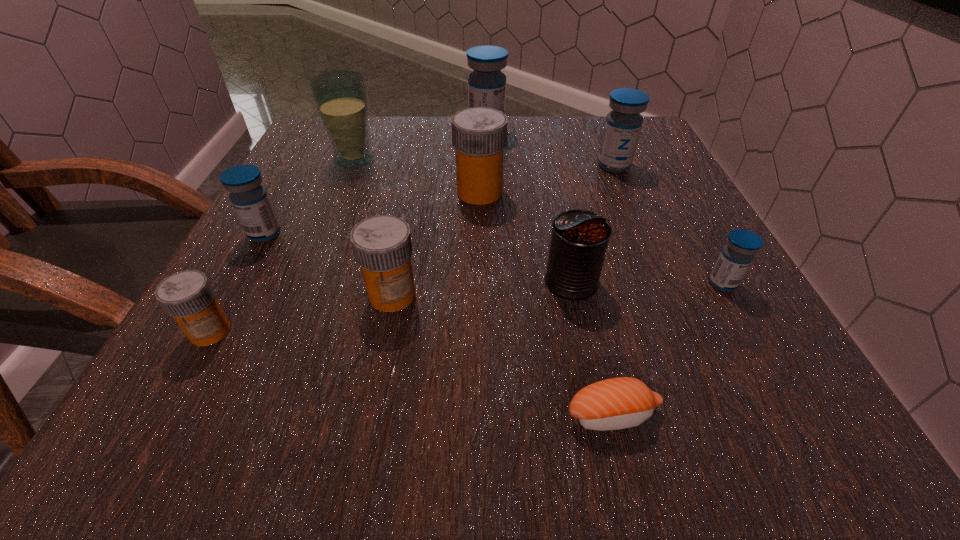
Point out which medicine is positioned as the sixth nearest to the ninth farthest object. Please provide its 2D coordinates. Your answer should be formatted as a tuple, i.e. [(x, y)], where the tuple contains the x and y coordinates of a point satisfying the conditions above.

[(623, 124)]

Where is `medicine identified as the fourth closest to the third blue medicine from right to left`? Image resolution: width=960 pixels, height=540 pixels. medicine identified as the fourth closest to the third blue medicine from right to left is located at coordinates (382, 246).

This screenshot has width=960, height=540. I want to click on the fourth closest blue medicine to the third object from left to right, so click(737, 255).

This screenshot has height=540, width=960. Find the location of `blue medicine that is the closest to the leftmost orange medicine`. blue medicine that is the closest to the leftmost orange medicine is located at coordinates (250, 200).

You are a GUI agent. You are given a task and a screenshot of the screen. Output one action in this format:
    pyautogui.click(x=<x>, y=<y>)
    Task: Click on the orange medicine that can be found as the third closest to the nearest object
    
    Given the screenshot: What is the action you would take?
    pyautogui.click(x=187, y=296)

Locate an element on the screen. orange medicine that is the second closest one to the biggest blue medicine is located at coordinates (382, 246).

Identify the location of vacant region that satisfies the following two spatial constraints: 1. on the back side of the sixth medicine from left to right; 2. on the left side of the fourth farthest medicine. Image resolution: width=960 pixels, height=540 pixels. (303, 166).

The width and height of the screenshot is (960, 540). Identify the location of free point that satisfies the following two spatial constraints: 1. on the back side of the can; 2. on the label side of the rightmost orange medicine. (552, 192).

The height and width of the screenshot is (540, 960). What are the coordinates of `free spot that satisfies the following two spatial constraints: 1. on the label side of the fourth farthest object; 2. on the back side of the rightmost object` in the screenshot? It's located at (479, 284).

Where is `free spot that satisfies the following two spatial constraints: 1. on the label side of the nearest medicine; 2. on the left side of the salmon sushi`? free spot that satisfies the following two spatial constraints: 1. on the label side of the nearest medicine; 2. on the left side of the salmon sushi is located at coordinates (163, 415).